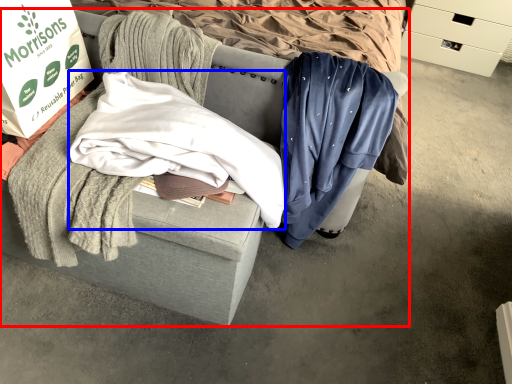
Question: Which object appears farthest to the camera in this image, furniture (highlighted by a red box) or clothing (highlighted by a blue box)?

Choices:
 (A) furniture
 (B) clothing

Answer: (B)